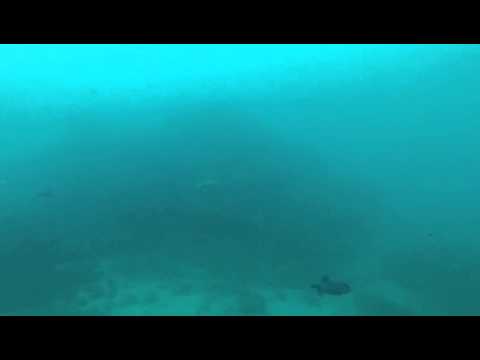
Find the location of a particular element. larger plants is located at coordinates (420, 266), (197, 254), (20, 292).